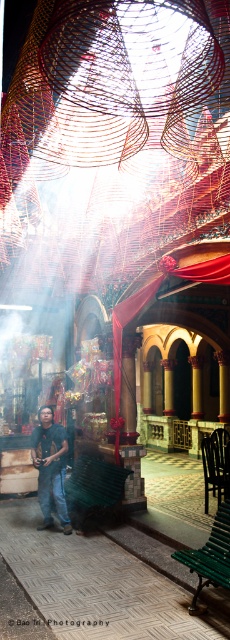
You are a visitor to the temple and need to sit down. There are two benches available in the scene. The green plastic bench at lower center and the green wooden bench at lower center. Which bench is closer to the altar?

The green plastic bench at lower center and green wooden bench at lower center are 10.17 feet apart from each other. However, the question does not provide information about their distance to the altar, so I cannot determine which one is closer.

Looking at this image, you are an interior designer planning to place a 1.2 meter wide decorative panel in this temple. The dark gray shirt at center and the green wooden bench at lower center are in the way. Which object must you move to accommodate the panel?

The dark gray shirt at center must be moved because its width surpasses the green wooden bench at lower center, making it the wider obstacle and thus requiring relocation to fit the 1.2 meter wide panel.